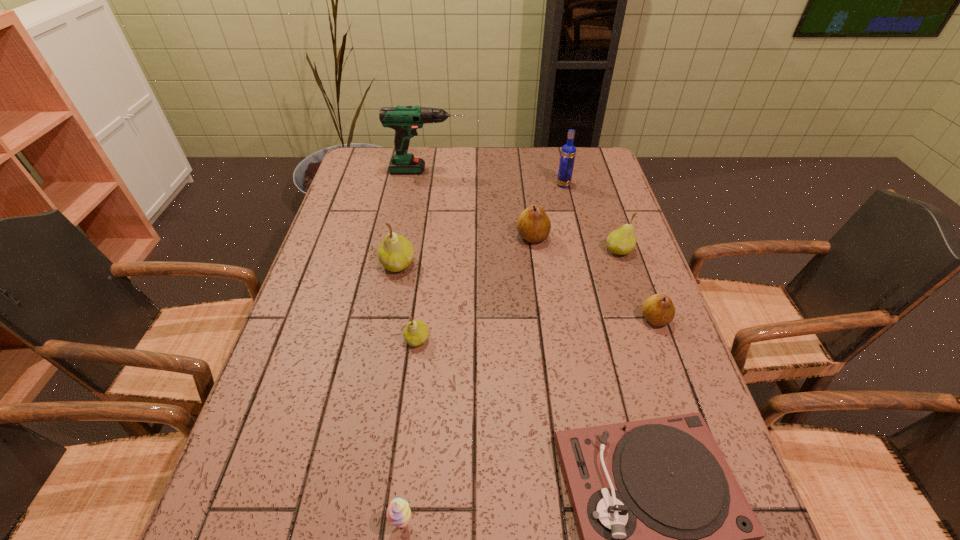
I want to click on free space that is in between the second biggest green pear and the green drill, so click(x=523, y=211).

Where is `vacant area between the smaller brown pear and the second green pear from right to left`? The height and width of the screenshot is (540, 960). vacant area between the smaller brown pear and the second green pear from right to left is located at coordinates click(x=536, y=329).

The width and height of the screenshot is (960, 540). Identify the location of blank region between the left brown pear and the second tallest object. (548, 211).

Locate an element on the screen. object that stands as the eighth closest to the nearest green pear is located at coordinates (568, 152).

Locate which object is the seventh closest to the right brown pear. Please provide its 2D coordinates. Your answer should be formatted as a tuple, i.e. [(x, y)], where the tuple contains the x and y coordinates of a point satisfying the conditions above.

[(398, 513)]

Select which pear is the fourth closest to the second smallest green pear. Please provide its 2D coordinates. Your answer should be formatted as a tuple, i.e. [(x, y)], where the tuple contains the x and y coordinates of a point satisfying the conditions above.

[(395, 252)]

Identify which pear is the nearest to the drill. Please provide its 2D coordinates. Your answer should be formatted as a tuple, i.e. [(x, y)], where the tuple contains the x and y coordinates of a point satisfying the conditions above.

[(533, 225)]

Choose which green pear is the nearest neighbor to the phonograph_record. Please provide its 2D coordinates. Your answer should be formatted as a tuple, i.e. [(x, y)], where the tuple contains the x and y coordinates of a point satisfying the conditions above.

[(416, 332)]

Select which green pear is the third closest to the phonograph_record. Please provide its 2D coordinates. Your answer should be formatted as a tuple, i.e. [(x, y)], where the tuple contains the x and y coordinates of a point satisfying the conditions above.

[(395, 252)]

I want to click on vacant area in the image that satisfies the following two spatial constraints: 1. on the front side of the right brown pear; 2. on the right side of the rightmost green pear, so click(x=642, y=319).